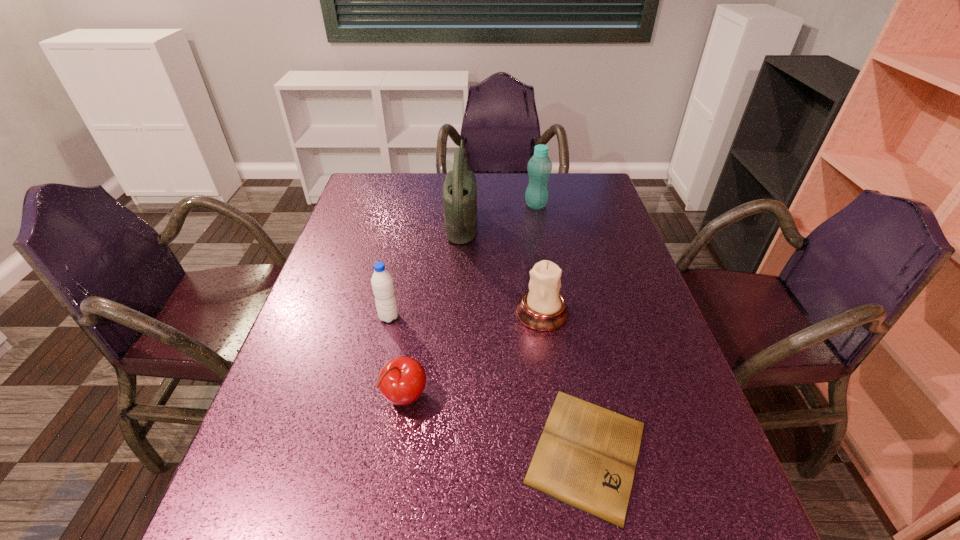
Identify the location of vacant area at the far left corner. Image resolution: width=960 pixels, height=540 pixels. (373, 176).

In the image, there is a desktop. What are the coordinates of `blank space at the far right corner` in the screenshot? It's located at (584, 176).

I want to click on free area in between the watering can and the nearer water bottle, so click(425, 268).

Locate an element on the screen. Image resolution: width=960 pixels, height=540 pixels. unoccupied position between the right water bottle and the shorter water bottle is located at coordinates (463, 261).

You are a GUI agent. You are given a task and a screenshot of the screen. Output one action in this format:
    pyautogui.click(x=<x>, y=<y>)
    Task: Click on the vacant space that is in between the left water bottle and the book
    The height and width of the screenshot is (540, 960).
    Given the screenshot: What is the action you would take?
    pyautogui.click(x=488, y=384)

Identify the location of unoccupied position between the shortest object and the watering can. (524, 335).

I want to click on vacant space that is in between the shortest object and the second shortest object, so click(x=496, y=425).

In order to click on vacant area that lies between the second shortest object and the taller water bottle in this screenshot , I will do `click(470, 302)`.

Where is `empty space between the watering can and the book`? empty space between the watering can and the book is located at coordinates (524, 335).

Where is `free space that is in between the cherry and the book`? free space that is in between the cherry and the book is located at coordinates (496, 425).